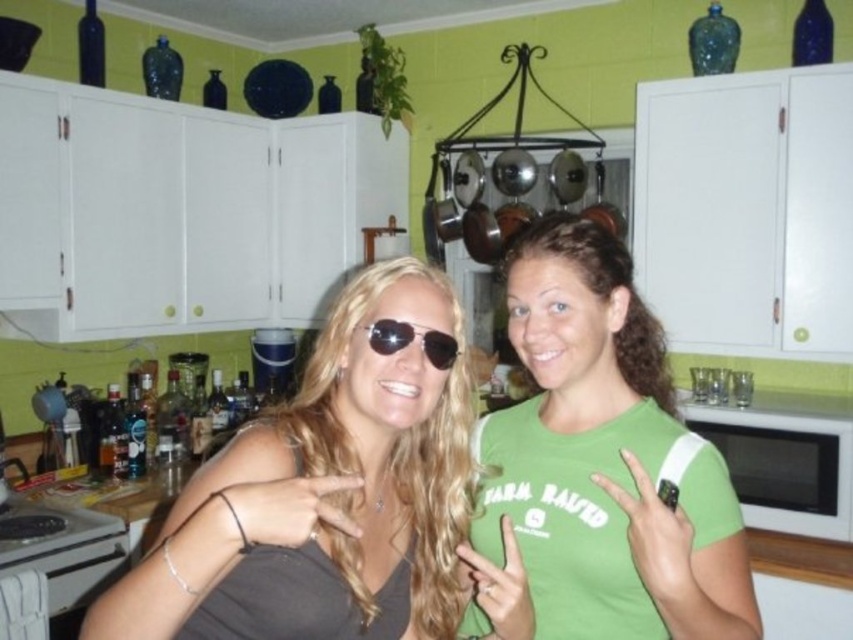
Question: Is matte gray tank top at center smaller than green cotton shirt at center?

Choices:
 (A) yes
 (B) no

Answer: (A)

Question: Which object is closer to the camera taking this photo?

Choices:
 (A) sunglasses at center
 (B) white matte microwave at right

Answer: (A)

Question: Can you confirm if matte gray tank top at center is wider than green cotton shirt at center?

Choices:
 (A) yes
 (B) no

Answer: (A)

Question: Which point is closer to the camera?

Choices:
 (A) (712, 422)
 (B) (155, 625)

Answer: (B)

Question: Which object appears farthest from the camera in this image?

Choices:
 (A) sunglasses at center
 (B) green cotton shirt at center
 (C) matte gray tank top at center

Answer: (A)

Question: In this image, where is green cotton shirt at center located relative to sunglasses at center?

Choices:
 (A) below
 (B) above

Answer: (A)